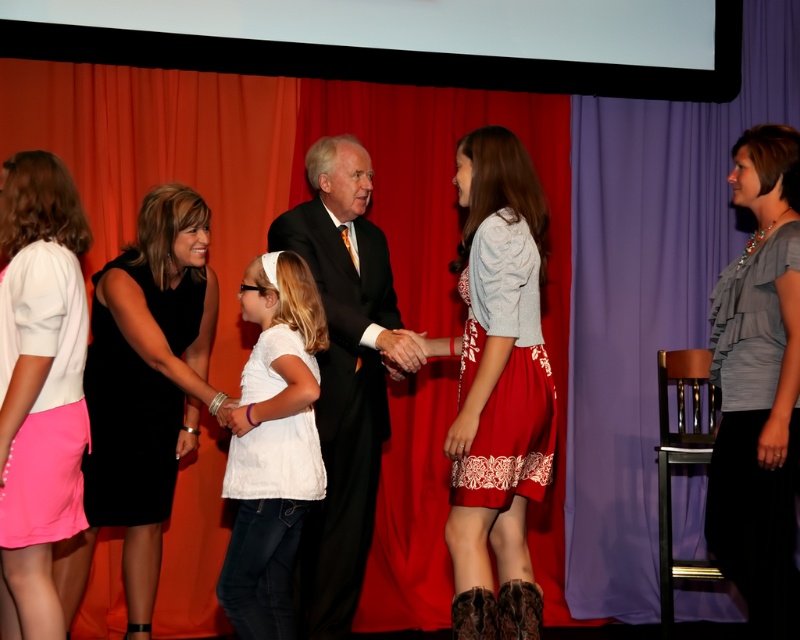
Between point (137, 356) and point (790, 208), which one is positioned behind?

The point (137, 356) is more distant.

Can you confirm if black dress at center is positioned to the left of gray satin blouse at right?

Indeed, black dress at center is positioned on the left side of gray satin blouse at right.

The height and width of the screenshot is (640, 800). I want to click on black dress at center, so click(144, 392).

From the picture: Is black suit at center closer to camera compared to pink fabric skirt at lower left?

No, it is not.

Is black suit at center to the right of pink fabric skirt at lower left from the viewer's perspective?

Correct, you'll find black suit at center to the right of pink fabric skirt at lower left.

Is point (324, 161) closer to camera compared to point (24, 365)?

No, (324, 161) is behind (24, 365).

The width and height of the screenshot is (800, 640). Find the location of `black suit at center`. black suit at center is located at coordinates (344, 374).

Is point (121, 467) less distant than point (268, 403)?

No, it is behind (268, 403).

Is black dress at center thinner than white cotton shirt at center?

No.

Does point (176, 307) come farther from viewer compared to point (266, 324)?

Yes.

Where is `black dress at center`? Image resolution: width=800 pixels, height=640 pixels. black dress at center is located at coordinates (144, 392).